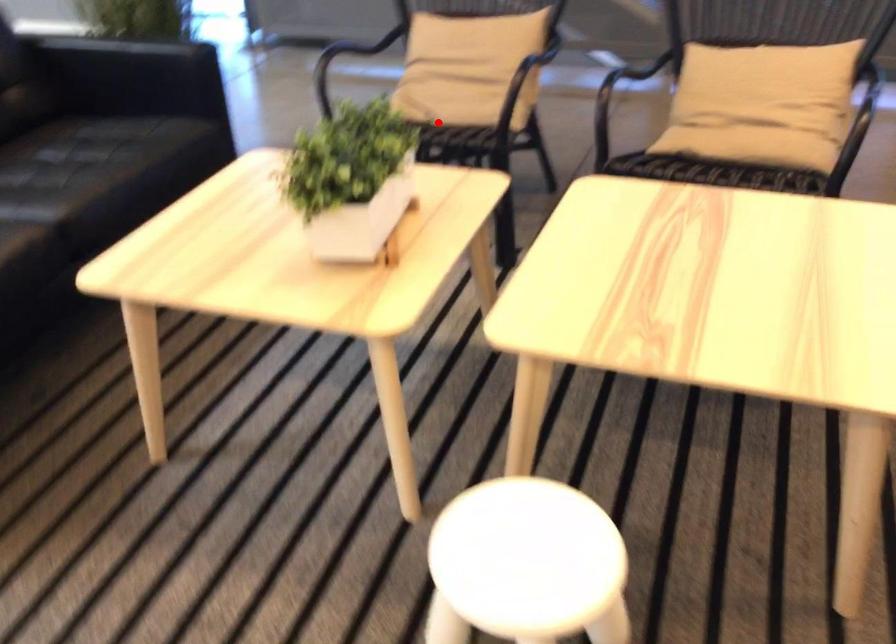
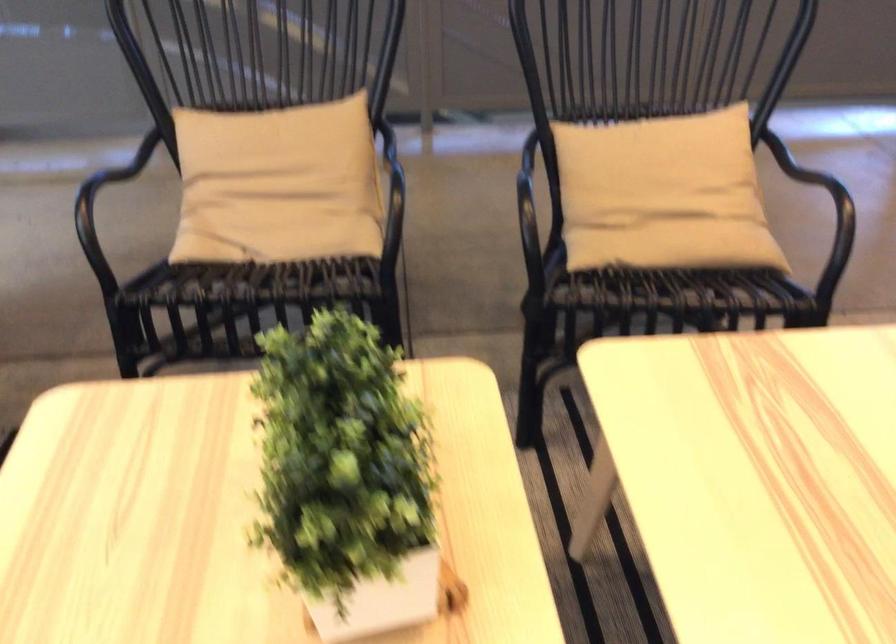
In the second image, find the point that corresponds to the highlighted location in the first image.

(268, 267)